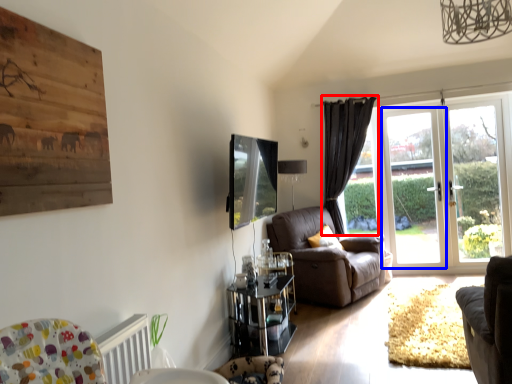
Question: Which object is further to the camera taking this photo, curtain (highlighted by a red box) or screen door (highlighted by a blue box)?

Choices:
 (A) curtain
 (B) screen door

Answer: (A)